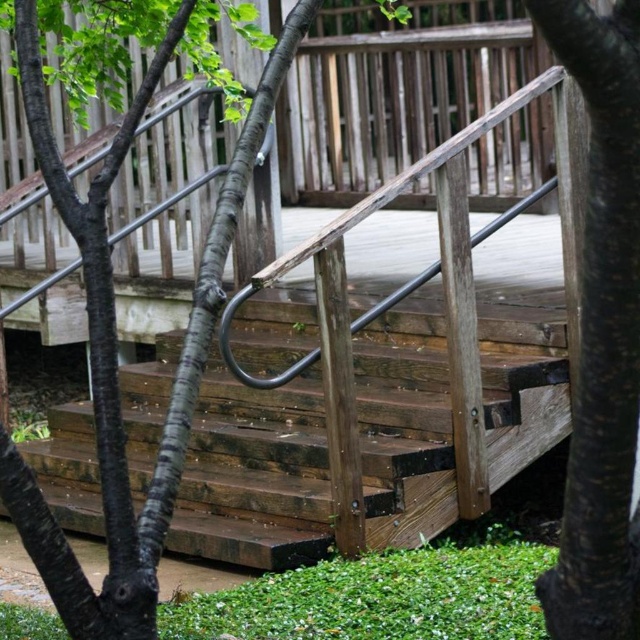
You are standing at the bottom of the wooden staircase and want to reach the deck above. There are two points marked on the staircase. The first point is at coordinates point(x=534, y=308) and the second point is at point(x=605, y=301). Which point is closer to you as you stand at the base of the stairs?

Point(x=534, y=308) is closer to you because it is further to the camera than point(x=605, y=301), meaning it is nearer to your position at the base of the stairs.